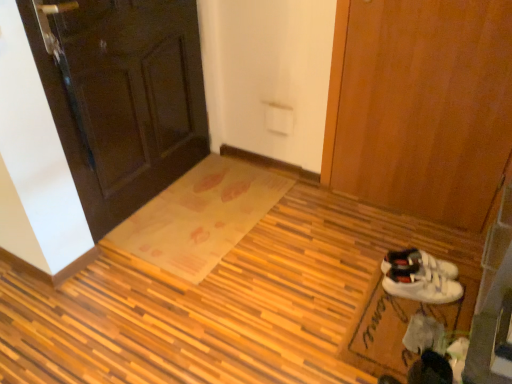
Identify the location of wooden mat at center. (221, 303).

You are a GUI agent. You are given a task and a screenshot of the screen. Output one action in this format:
    pyautogui.click(x=<x>, y=<y>)
    Task: Click on the wooden mat at center
    This screenshot has height=384, width=512.
    Given the screenshot: What is the action you would take?
    pyautogui.click(x=221, y=303)

Considering the relative positions of translucent plastic doormat at center, the 2th doormat in the front-to-back sequence, and wooden mat at center in the image provided, is translucent plastic doormat at center, the 2th doormat in the front-to-back sequence, to the right of wooden mat at center from the viewer's perspective?

No.

Who is shorter, translucent plastic doormat at center, the 1th doormat when ordered from left to right, or wooden mat at center?

With less height is translucent plastic doormat at center, the 1th doormat when ordered from left to right.

Does point (256, 220) come in front of point (274, 371)?

That is False.

In the scene shown: From a real-world perspective, which is physically above, dark wood door at upper left, the 1th door from the left, or wooden door at right, marked as the first door in a right-to-left arrangement?

In real-world perspective, dark wood door at upper left, the 1th door from the left, is above.

Is dark wood door at upper left, placed as the second door when sorted from right to left, positioned far away from wooden door at right, the 2th door positioned from the left?

Indeed, dark wood door at upper left, placed as the second door when sorted from right to left, is not near wooden door at right, the 2th door positioned from the left.

How distant is dark wood door at upper left, the 1th door from the left, from wooden door at right, the 2th door positioned from the left?

They are 1.10 meters apart.

Is wooden mat at center shorter than dark wood door at upper left, the 1th door from the left?

Yes, wooden mat at center is shorter than dark wood door at upper left, the 1th door from the left.

Is wooden mat at center spatially inside dark wood door at upper left, placed as the second door when sorted from right to left, or outside of it?

wooden mat at center exists outside the volume of dark wood door at upper left, placed as the second door when sorted from right to left.

Considering the sizes of objects wooden mat at center and dark wood door at upper left, placed as the second door when sorted from right to left, in the image provided, who is bigger, wooden mat at center or dark wood door at upper left, placed as the second door when sorted from right to left,?

Bigger between the two is wooden mat at center.

You are a GUI agent. You are given a task and a screenshot of the screen. Output one action in this format:
    pyautogui.click(x=<x>, y=<y>)
    Task: Click on the plywood that is in front of the dark wood door at upper left, placed as the second door when sorted from right to left
    
    Given the screenshot: What is the action you would take?
    pyautogui.click(x=221, y=303)

Can you confirm if wooden door at right, the 2th door positioned from the left, is bigger than dark wood door at upper left, the 1th door from the left?

Incorrect, wooden door at right, the 2th door positioned from the left, is not larger than dark wood door at upper left, the 1th door from the left.

From the picture: Is dark wood door at upper left, the 1th door from the left, surrounded by wooden door at right, marked as the first door in a right-to-left arrangement?

No, dark wood door at upper left, the 1th door from the left, is not inside wooden door at right, marked as the first door in a right-to-left arrangement.

From a real-world perspective, which is physically above, wooden door at right, marked as the first door in a right-to-left arrangement, or dark wood door at upper left, the 1th door from the left?

In real-world perspective, dark wood door at upper left, the 1th door from the left, is above.

Considering the positions of objects wooden door at right, marked as the first door in a right-to-left arrangement, and dark wood door at upper left, placed as the second door when sorted from right to left, in the image provided, who is more to the right, wooden door at right, marked as the first door in a right-to-left arrangement, or dark wood door at upper left, placed as the second door when sorted from right to left,?

Positioned to the right is wooden door at right, marked as the first door in a right-to-left arrangement.

Can you confirm if translucent plastic doormat at center, which ranks as the 1th doormat in back-to-front order, is positioned to the right of white suede sneakers at lower right?

In fact, translucent plastic doormat at center, which ranks as the 1th doormat in back-to-front order, is to the left of white suede sneakers at lower right.

From the picture: Considering the relative positions of translucent plastic doormat at center, the 2th doormat in the front-to-back sequence, and white suede sneakers at lower right in the image provided, is translucent plastic doormat at center, the 2th doormat in the front-to-back sequence, in front of white suede sneakers at lower right?

No, it is not.

Considering the sizes of objects translucent plastic doormat at center, which ranks as the 1th doormat in back-to-front order, and white suede sneakers at lower right in the image provided, who is thinner, translucent plastic doormat at center, which ranks as the 1th doormat in back-to-front order, or white suede sneakers at lower right?

With smaller width is white suede sneakers at lower right.

From a real-world perspective, between translucent plastic doormat at center, placed as the second doormat when sorted from right to left, and white suede sneakers at lower right, who is vertically lower?

translucent plastic doormat at center, placed as the second doormat when sorted from right to left, is physically lower.

Is white fabric doormat at lower right, arranged as the 2th doormat when viewed from the left, inside or outside of dark wood door at upper left, placed as the second door when sorted from right to left?

white fabric doormat at lower right, arranged as the 2th doormat when viewed from the left, cannot be found inside dark wood door at upper left, placed as the second door when sorted from right to left.

Is white fabric doormat at lower right, arranged as the 2th doormat when viewed from the left, bigger or smaller than dark wood door at upper left, the 1th door from the left?

Clearly, white fabric doormat at lower right, arranged as the 2th doormat when viewed from the left, is smaller in size than dark wood door at upper left, the 1th door from the left.

Identify the location of door located in front of the white fabric doormat at lower right, which ranks as the second doormat in back-to-front order. Image resolution: width=512 pixels, height=384 pixels. (125, 99).

From the image's perspective, which one is positioned higher, translucent plastic doormat at center, the 2th doormat in the front-to-back sequence, or white fabric doormat at lower right, which is the first doormat in right-to-left order?

From the image's view, translucent plastic doormat at center, the 2th doormat in the front-to-back sequence, is above.

This screenshot has width=512, height=384. In order to click on doormat in front of the translucent plastic doormat at center, the 2th doormat in the front-to-back sequence in this screenshot , I will do `click(403, 313)`.

From a real-world perspective, is translucent plastic doormat at center, which ranks as the 1th doormat in back-to-front order, positioned under white fabric doormat at lower right, which is the first doormat in right-to-left order, based on gravity?

Yes, from a real-world perspective, translucent plastic doormat at center, which ranks as the 1th doormat in back-to-front order, is beneath white fabric doormat at lower right, which is the first doormat in right-to-left order.

Where is `the 2nd doormat behind the wooden mat at center, starting your count from the anchor`? Image resolution: width=512 pixels, height=384 pixels. the 2nd doormat behind the wooden mat at center, starting your count from the anchor is located at coordinates (200, 217).

The width and height of the screenshot is (512, 384). Find the location of `door in front of the wooden door at right, marked as the first door in a right-to-left arrangement`. door in front of the wooden door at right, marked as the first door in a right-to-left arrangement is located at coordinates (125, 99).

Estimate the real-world distances between objects in this image. Which object is further from white fabric doormat at lower right, which is the first doormat in right-to-left order, white suede sneakers at lower right or dark wood door at upper left, the 1th door from the left?

dark wood door at upper left, the 1th door from the left, is positioned further to the anchor white fabric doormat at lower right, which is the first doormat in right-to-left order.

When comparing their distances from wooden mat at center, does wooden door at right, marked as the first door in a right-to-left arrangement, or white suede sneakers at lower right seem further?

The object further to wooden mat at center is wooden door at right, marked as the first door in a right-to-left arrangement.

Considering their positions, is white suede sneakers at lower right positioned closer to translucent plastic doormat at center, the 2th doormat in the front-to-back sequence, than wooden mat at center?

Based on the image, wooden mat at center appears to be nearer to translucent plastic doormat at center, the 2th doormat in the front-to-back sequence.

Looking at the image, which one is located further to translucent plastic doormat at center, the 1th doormat when ordered from left to right, dark wood door at upper left, the 1th door from the left, or white suede sneakers at lower right?

white suede sneakers at lower right is further to translucent plastic doormat at center, the 1th doormat when ordered from left to right.

Based on their spatial positions, is dark wood door at upper left, the 1th door from the left, or white fabric doormat at lower right, which ranks as the second doormat in back-to-front order, closer to white suede sneakers at lower right?

white fabric doormat at lower right, which ranks as the second doormat in back-to-front order, is positioned closer to the anchor white suede sneakers at lower right.

Consider the image. From the image, which object appears to be nearer to wooden mat at center, white suede sneakers at lower right or dark wood door at upper left, the 1th door from the left?

Based on the image, white suede sneakers at lower right appears to be nearer to wooden mat at center.

Considering their positions, is translucent plastic doormat at center, the 1th doormat when ordered from left to right, positioned closer to white suede sneakers at lower right than white fabric doormat at lower right, which ranks as the second doormat in back-to-front order?

white fabric doormat at lower right, which ranks as the second doormat in back-to-front order, is positioned closer to the anchor white suede sneakers at lower right.

Estimate the real-world distances between objects in this image. Which object is further from wooden mat at center, white fabric doormat at lower right, the 1th doormat from the front, or dark wood door at upper left, the 1th door from the left?

dark wood door at upper left, the 1th door from the left, is further to wooden mat at center.

Where is `footwear between wooden door at right, marked as the first door in a right-to-left arrangement, and white fabric doormat at lower right, the 1th doormat from the front, in the up-down direction`? footwear between wooden door at right, marked as the first door in a right-to-left arrangement, and white fabric doormat at lower right, the 1th doormat from the front, in the up-down direction is located at coordinates 420,277.

This screenshot has height=384, width=512. I want to click on plywood between dark wood door at upper left, placed as the second door when sorted from right to left, and white fabric doormat at lower right, the 1th doormat from the front, from left to right, so click(x=221, y=303).

Where is `doormat situated between dark wood door at upper left, placed as the second door when sorted from right to left, and white fabric doormat at lower right, which is the first doormat in right-to-left order, from left to right`? The width and height of the screenshot is (512, 384). doormat situated between dark wood door at upper left, placed as the second door when sorted from right to left, and white fabric doormat at lower right, which is the first doormat in right-to-left order, from left to right is located at coordinates (200, 217).

This screenshot has width=512, height=384. Identify the location of plywood situated between translucent plastic doormat at center, the 2th doormat in the front-to-back sequence, and wooden door at right, marked as the first door in a right-to-left arrangement, from left to right. (221, 303).